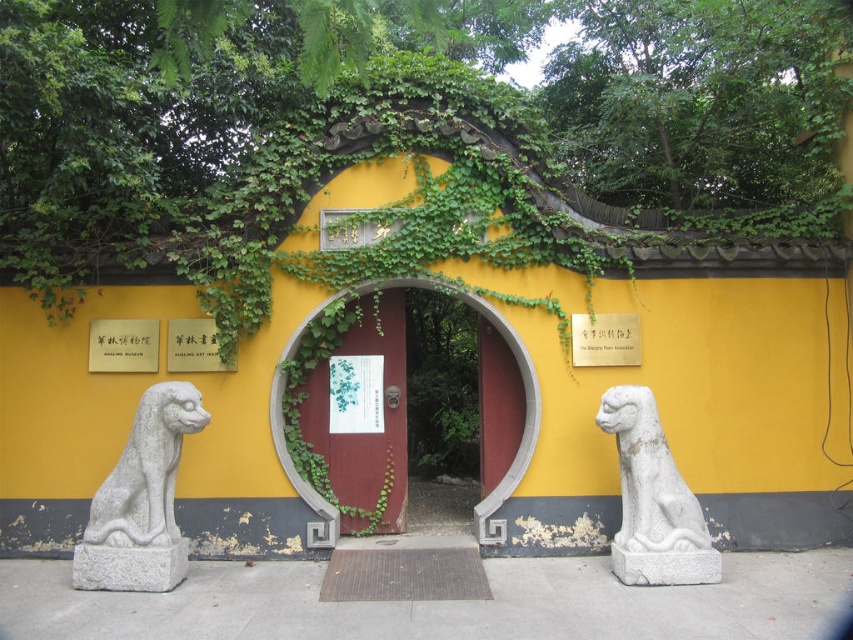
You are an architect designing a replica of this entrance. You need to ensure that the white stone lion at left and the white stone lion at right are proportionate. Which lion should you make wider?

The white stone lion at left should be made wider since its width surpasses that of the white stone lion at right according to the description.

You are standing at the entrance of the traditional Chinese building and want to place a small decoration between the two points labeled point (651, 410) and point (601, 337). Based on their positions, which point should the decoration be closer to in order to be in front of the other?

The decoration should be closer to point (651, 410) because it is in front of point (601, 337).

You are a delivery person trying to enter the entrance. The entrance has a narrow pathway between the white stone lion at right and the matte gold plaque at center. Can you pass through the pathway if you carry a large box that is 1.2 meters wide?

The white stone lion at right might be wider than matte gold plaque at center, so the pathway between them may not be wide enough for a 1.2 meter wide box. It is safer to check the actual width before attempting to pass through.